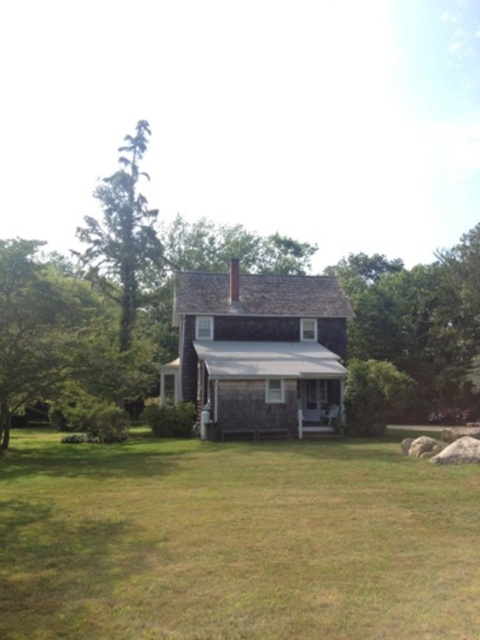
Question: Does green leafy tree at left appear under green textured tree at left?

Choices:
 (A) yes
 (B) no

Answer: (A)

Question: Which point is farther to the camera?

Choices:
 (A) green textured tree at left
 (B) green leafy tree at left

Answer: (A)

Question: Among these points, which one is nearest to the camera?

Choices:
 (A) (103, 374)
 (B) (139, 282)

Answer: (A)

Question: Is green leafy tree at left thinner than green textured tree at left?

Choices:
 (A) no
 (B) yes

Answer: (B)

Question: Is green leafy tree at left bigger than green textured tree at left?

Choices:
 (A) no
 (B) yes

Answer: (A)

Question: Which object appears farthest from the camera in this image?

Choices:
 (A) green leafy tree at left
 (B) green textured tree at left

Answer: (B)